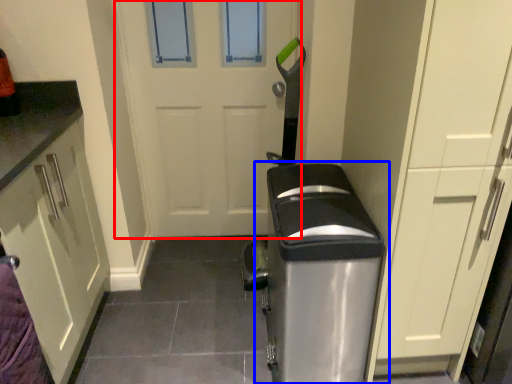
Question: Which of the following is the closest to the observer, door (highlighted by a red box) or home appliance (highlighted by a blue box)?

Choices:
 (A) door
 (B) home appliance

Answer: (B)